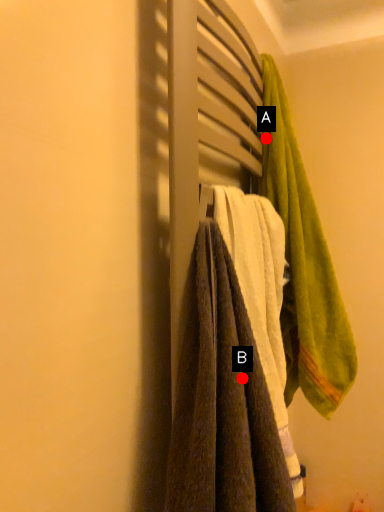
Question: Two points are circled on the image, labeled by A and B beside each circle. Which point is closer to the camera taking this photo?

Choices:
 (A) A is closer
 (B) B is closer

Answer: (B)